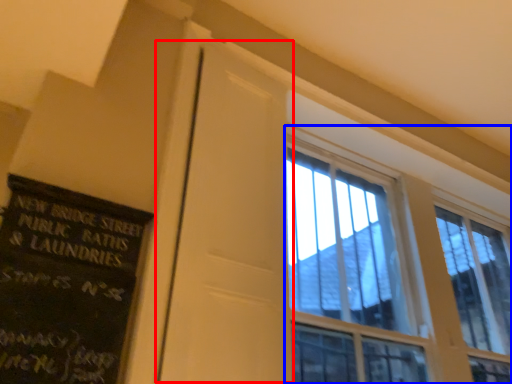
Question: Which object is closer to the camera taking this photo, screen door (highlighted by a red box) or window (highlighted by a blue box)?

Choices:
 (A) screen door
 (B) window

Answer: (A)